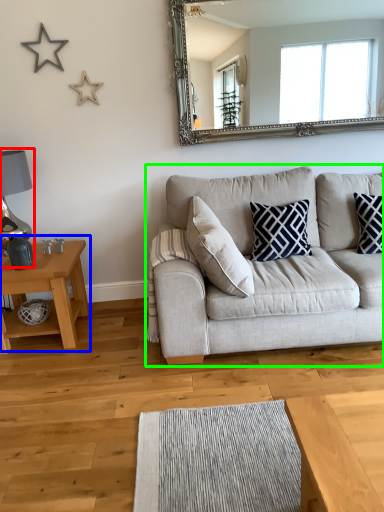
Question: Considering the real-world distances, which object is farthest from lamp (highlighted by a red box)? table (highlighted by a blue box) or studio couch (highlighted by a green box)?

Choices:
 (A) table
 (B) studio couch

Answer: (B)